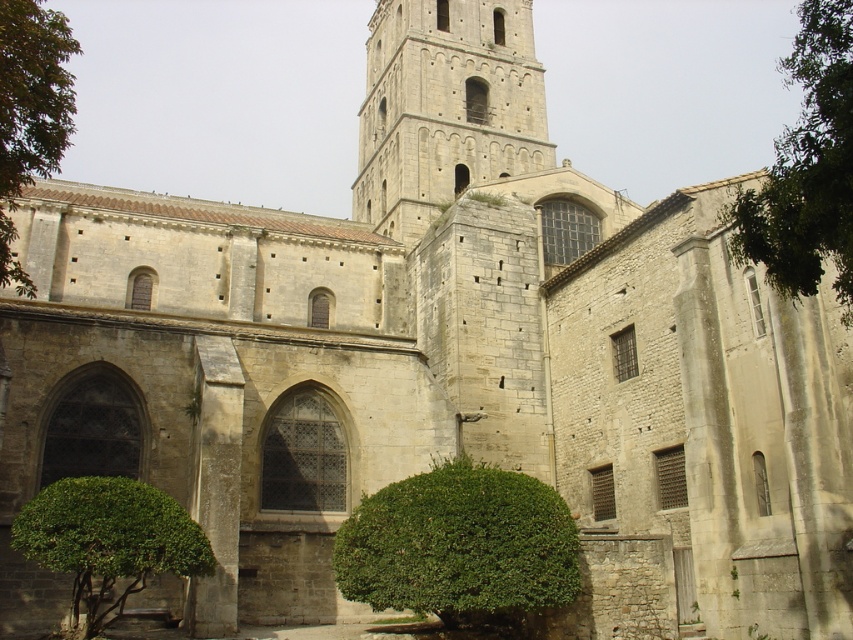
Does gray stone tower at center have a lesser width compared to green leafy bush at lower left?

No.

Is point (515, 141) farther from viewer compared to point (108, 538)?

Yes, it is behind point (108, 538).

This screenshot has height=640, width=853. I want to click on gray stone tower at center, so click(x=445, y=108).

Can you confirm if green leafy bush at lower left is positioned to the right of green leafy bush at left?

Indeed, green leafy bush at lower left is positioned on the right side of green leafy bush at left.

Does green leafy bush at lower left come behind green leafy bush at left?

Yes, green leafy bush at lower left is further from the viewer.

Who is more forward, (44,538) or (44,160)?

Point (44,160) is in front.

At what (x,y) coordinates should I click in order to perform the action: click on green leafy bush at lower left. Please return your answer as a coordinate pair (x, y). The height and width of the screenshot is (640, 853). Looking at the image, I should click on (108, 541).

Between point (819, 243) and point (77, 602), which one is positioned in front?

Point (819, 243) is more forward.

Can you confirm if green leafy tree at upper right is thinner than green leafy bush at lower left?

No.

Consider the image. Who is more forward, (821,58) or (113,566)?

Point (821,58) is in front.

Locate an element on the screen. Image resolution: width=853 pixels, height=640 pixels. green leafy tree at upper right is located at coordinates (805, 168).